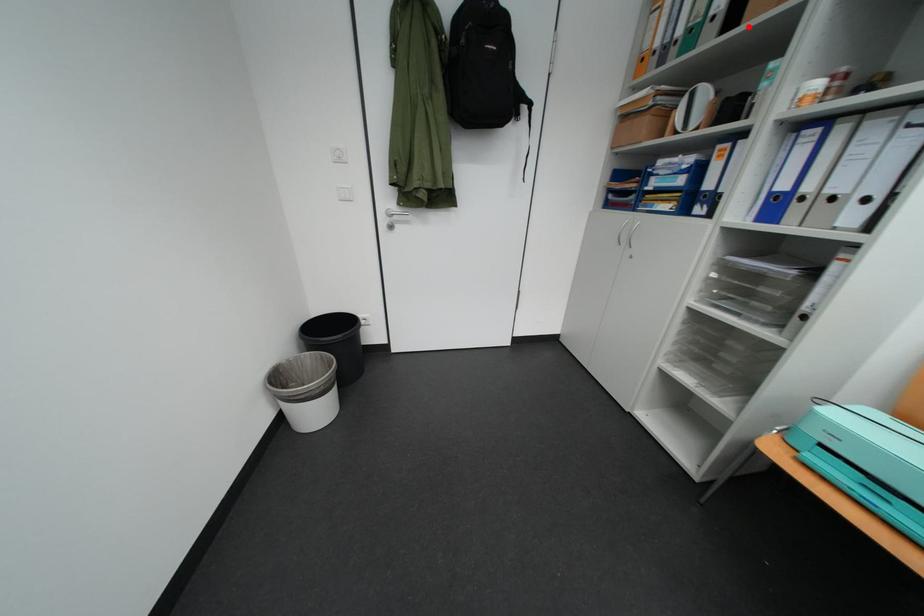
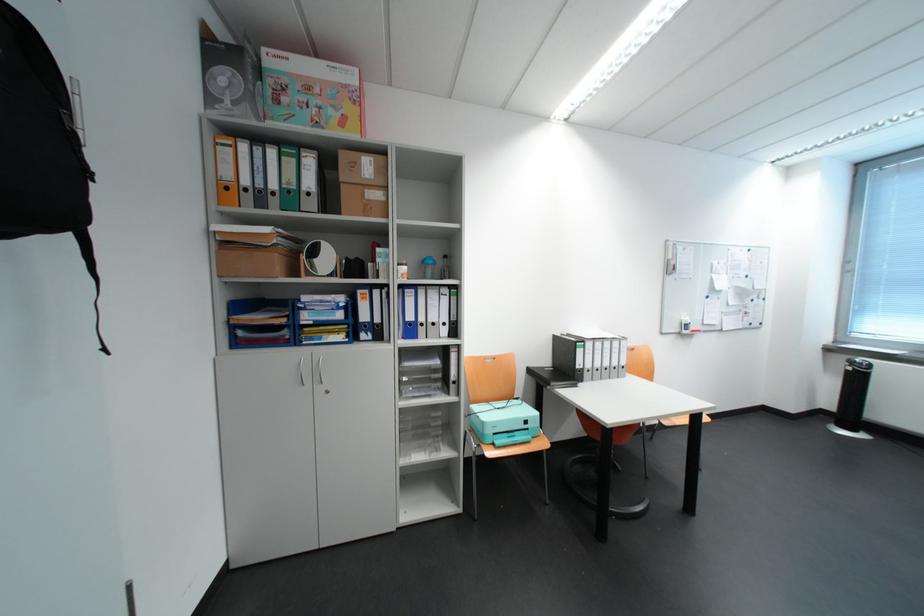
In the second image, find the point that corresponds to the highlighted location in the first image.

(351, 215)